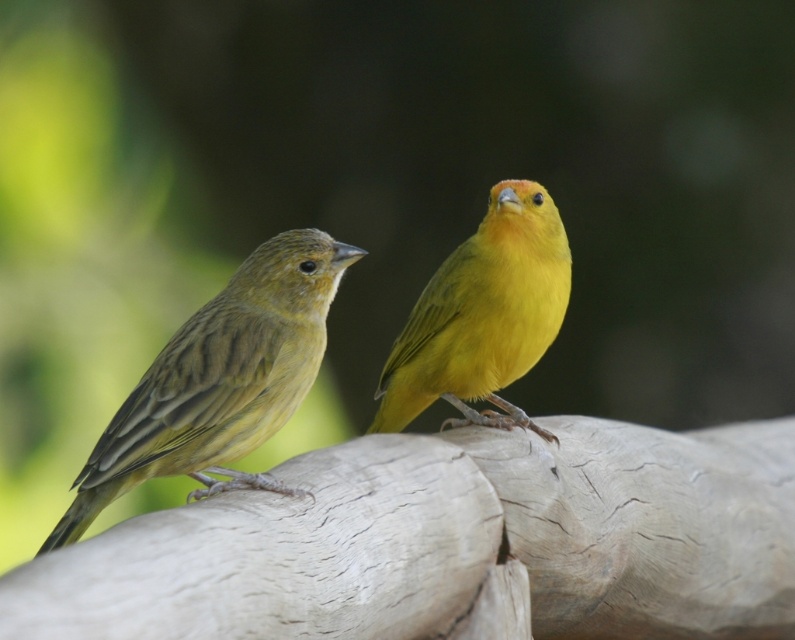
You are standing 5 feet away from a wooden fence where a matte yellow bird at left is perched. Can you reach the bird if you extend your arm fully, considering the bird is 4.17 feet away from you?

The matte yellow bird at left is 4.17 feet away from you, so yes, you can reach it by extending your arm fully since 4.17 feet is less than 5 feet.

You are a birdwatcher observing two birds on a wooden fence. You notice a matte yellow bird at left and a matte yellow canary at center. Which bird is taller?

The matte yellow canary at center is taller than the matte yellow bird at left.